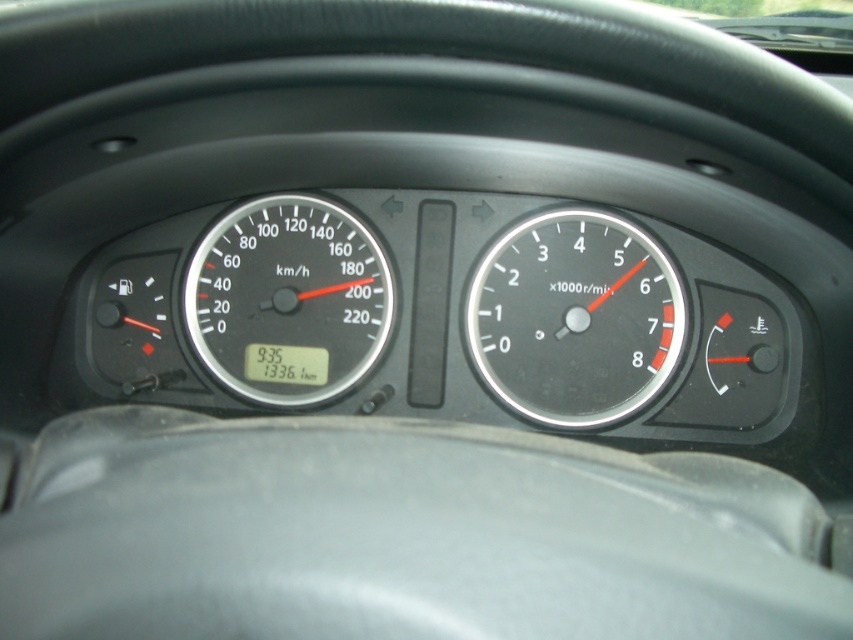
Is metallic silver speedometer at center above black plastic speedometer at center?

Actually, metallic silver speedometer at center is below black plastic speedometer at center.

Can you confirm if metallic silver speedometer at center is smaller than black plastic speedometer at center?

Yes, metallic silver speedometer at center is smaller than black plastic speedometer at center.

Measure the distance between point (x=618, y=220) and camera.

Point (x=618, y=220) and camera are 7.53 feet apart.

The height and width of the screenshot is (640, 853). Identify the location of metallic silver speedometer at center. (573, 317).